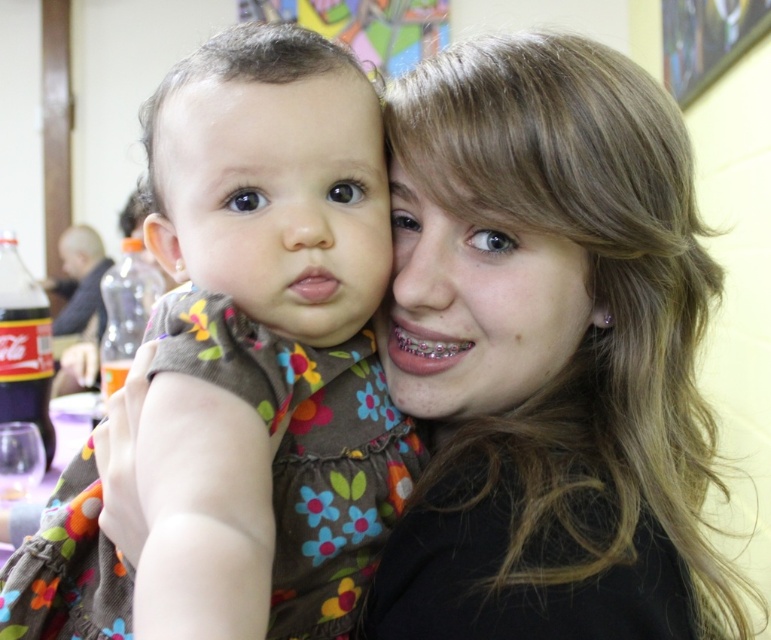
You are holding a 12 inch ruler and want to measure the distance between you and the point at coordinates point (46, 522). Can you reach it with your ruler?

The point at coordinates point (46, 522) is 23.31 inches from viewer, so the ruler is too short to reach it since it is only 12 inches long.

In the scene where a woman and a child are interacting, there is a point marked at coordinates (248, 365). Which object from the list below corresponds to this point? Choose between the woman in black top on the right and the floral fabric dress at center.

The point (248, 365) corresponds to the floral fabric dress at center.

Looking at the image, which object is larger in size between the floral fabric dress at center and the clear plastic braces at mouth center?

The floral fabric dress at center is bigger than clear plastic braces at mouth center.